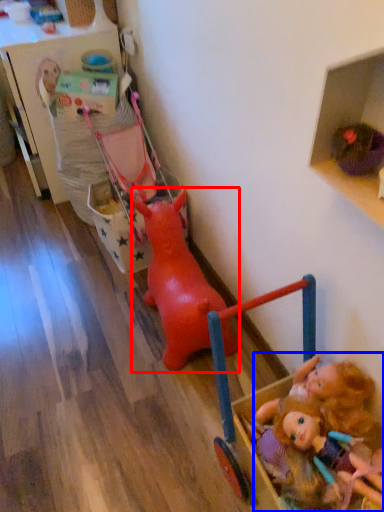
Question: Which object is further to the camera taking this photo, toy (highlighted by a red box) or person (highlighted by a blue box)?

Choices:
 (A) toy
 (B) person

Answer: (A)